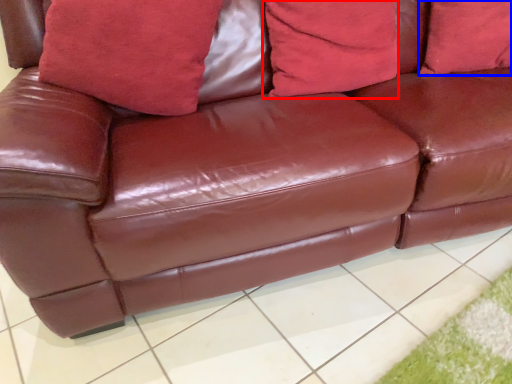
Question: Which of the following is the closest to the observer, pillow (highlighted by a red box) or pillow (highlighted by a blue box)?

Choices:
 (A) pillow
 (B) pillow

Answer: (A)